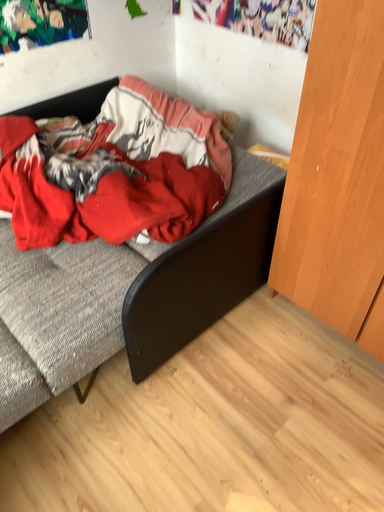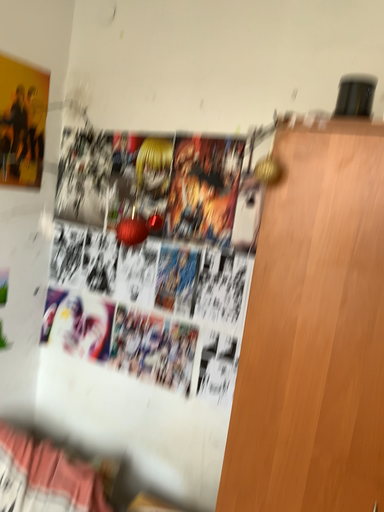
Question: How did the camera likely rotate when shooting the video?

Choices:
 (A) rotated right
 (B) rotated left

Answer: (A)